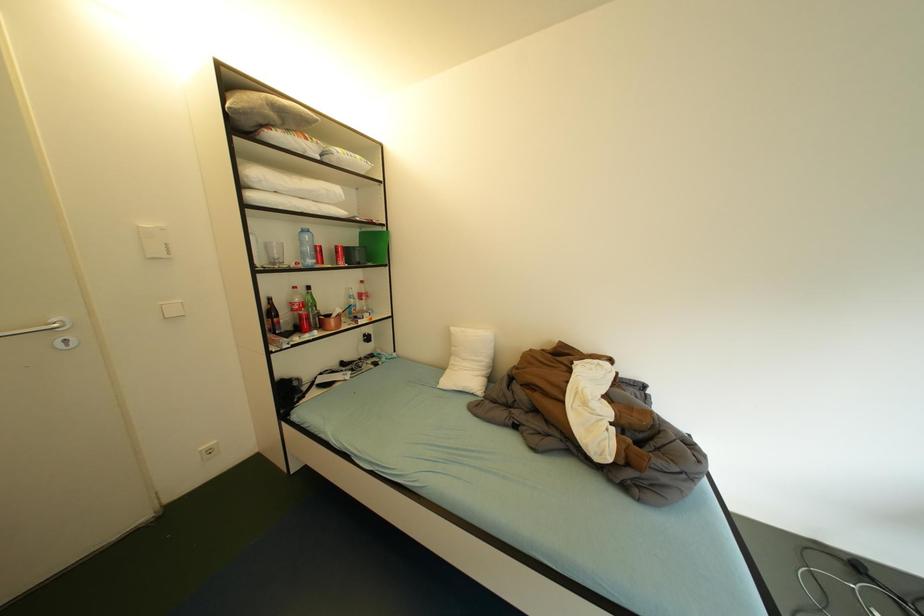
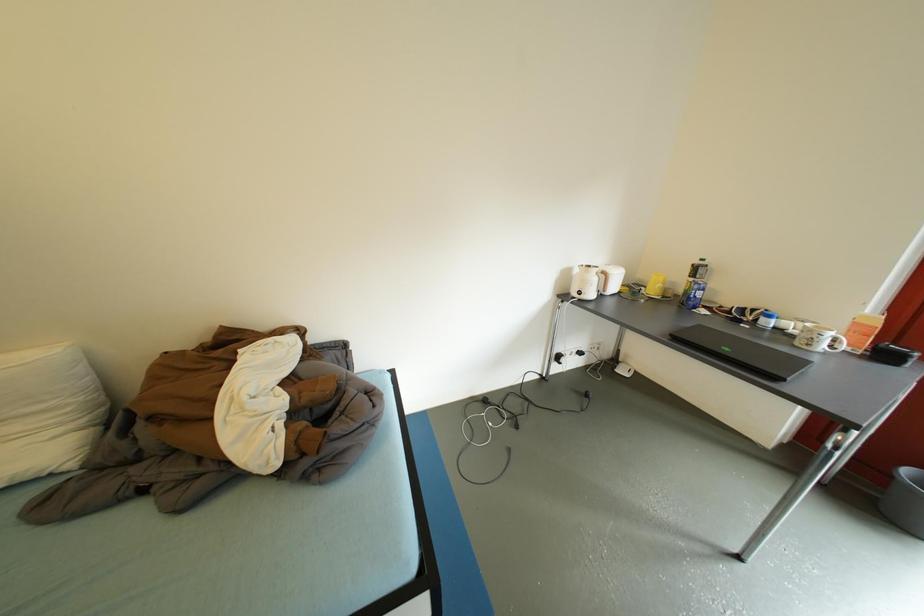
Question: The camera is either moving clockwise (left) or counter-clockwise (right) around the object. The first image is from the beginning of the video and the second image is from the end. Is the camera moving left or right when shooting the video?

Choices:
 (A) Left
 (B) Right

Answer: (A)